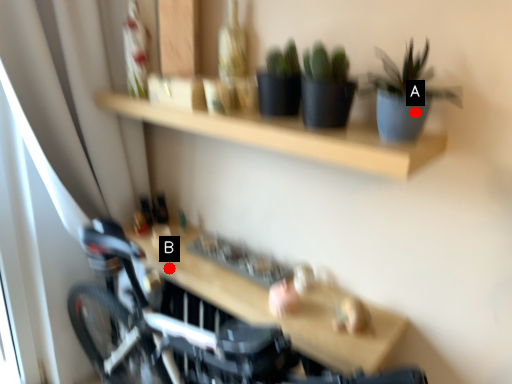
Question: Two points are circled on the image, labeled by A and B beside each circle. Which point is farther from the camera taking this photo?

Choices:
 (A) A is further
 (B) B is further

Answer: (B)